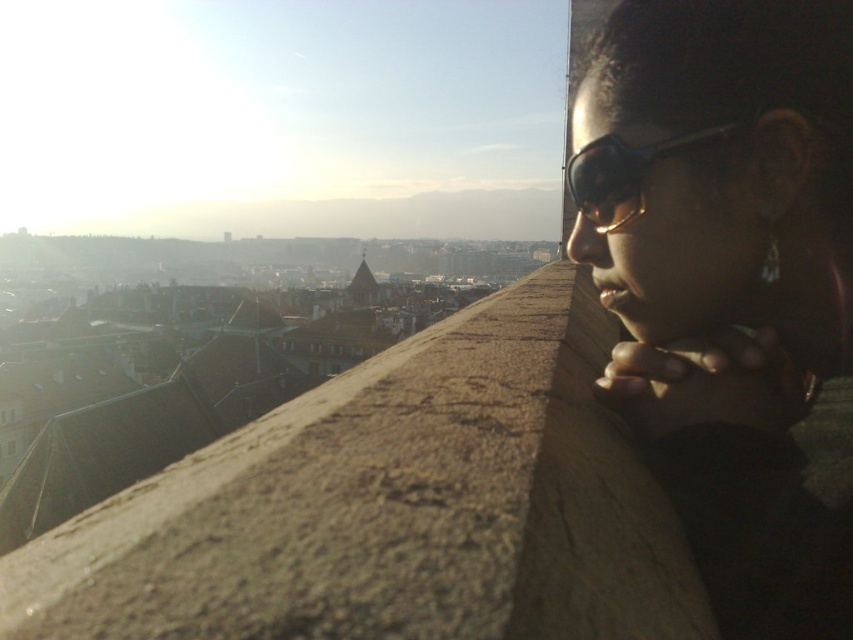
You are a photographer trying to capture the person in the scene. You notice two items on the person, the matte black sunglasses at upper right and the black matte goggles at upper right. Which one would appear larger in your photo?

The matte black sunglasses at upper right would appear larger in the photo because it is closer to the viewer than the black matte goggles at upper right.

Looking at this image, you are an optician examining two items on a shelf in the image. The items are the matte black sunglasses at upper right and the black matte goggles at upper right. Which item is located lower on the shelf?

The matte black sunglasses at upper right is positioned under the black matte goggles at upper right, so it is located lower on the shelf.

You are standing at point (627,180) and want to walk towards point (735,403). Is the path between these two points clear of any obstacles?

Point (735,403) is in front of point (627,180), so the path between them is clear of obstacles.